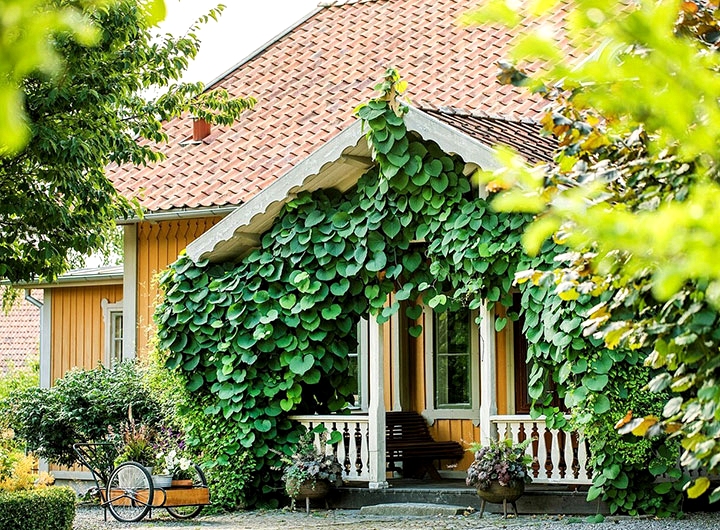
I want to click on black handle, so click(76, 446).